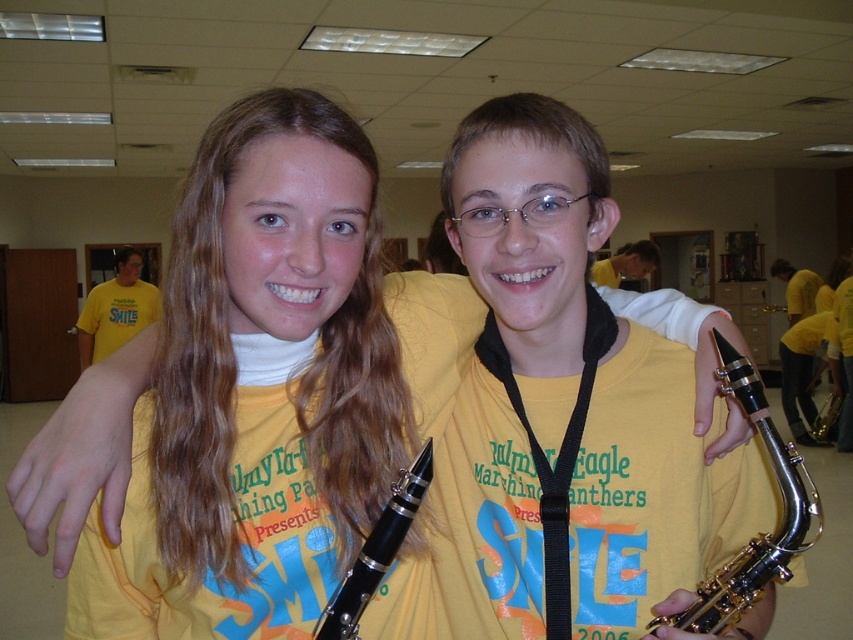
You are a music teacher setting up for a performance. You need to place the silver metallic saxophone at right and the gold metallic saxophone at center on a shelf. Which saxophone requires more horizontal space due to its width?

The silver metallic saxophone at right requires more horizontal space because its width surpasses the gold metallic saxophone at center.

You are taking a photo of two students in a school hallway. You notice two points marked at coordinates point (554,579) and point (816,419). If you want to focus on the point that is closer to your camera, which coordinate should you adjust your lens to?

Point (554,579) is closer to the camera than point (816,419), so you should adjust your lens to focus on point (554,579).

You are a photographer adjusting your camera to capture the two students in the image. You notice a silver metallic saxophone located at point (759,532). To ensure the saxophone is in focus, where should you position your camera relative to the two students?

The silver metallic saxophone at point (759,532) is located at the right side of the image. To focus on it, position the camera so it faces towards the right area where the saxophone is placed, ensuring it is within the frame.